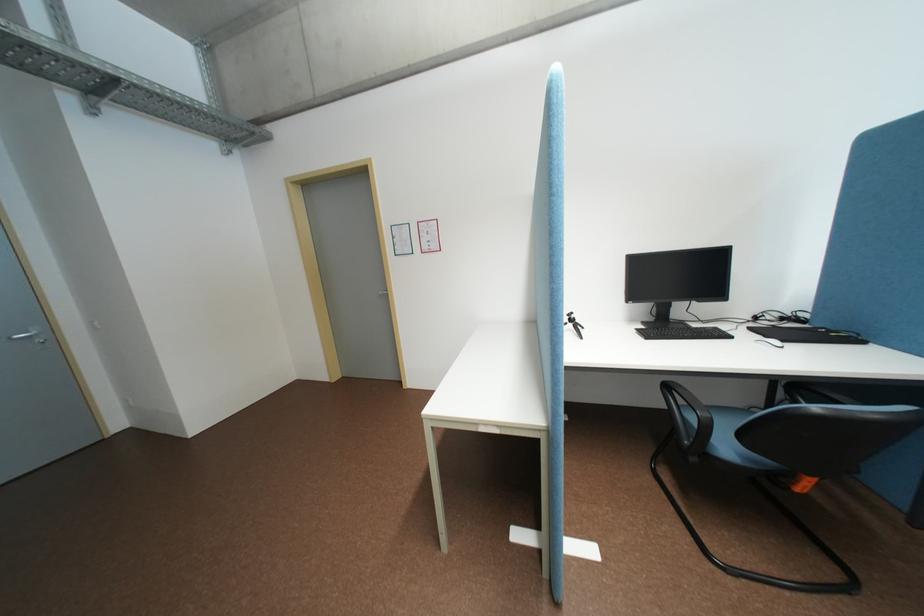
What do you see at coordinates (30, 334) in the screenshot?
I see `the silver door handle` at bounding box center [30, 334].